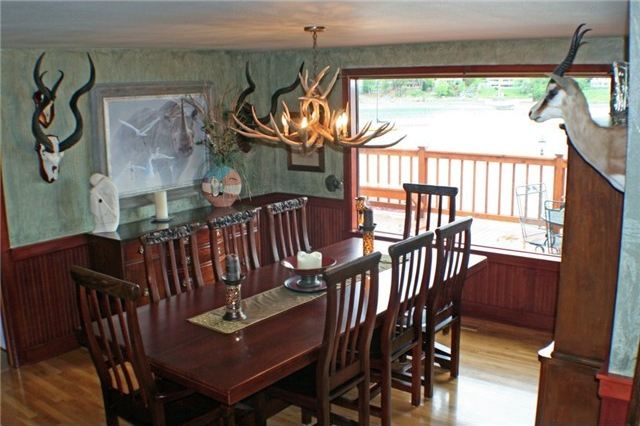
The image size is (640, 426). I want to click on candles, so click(232, 268), click(307, 259).